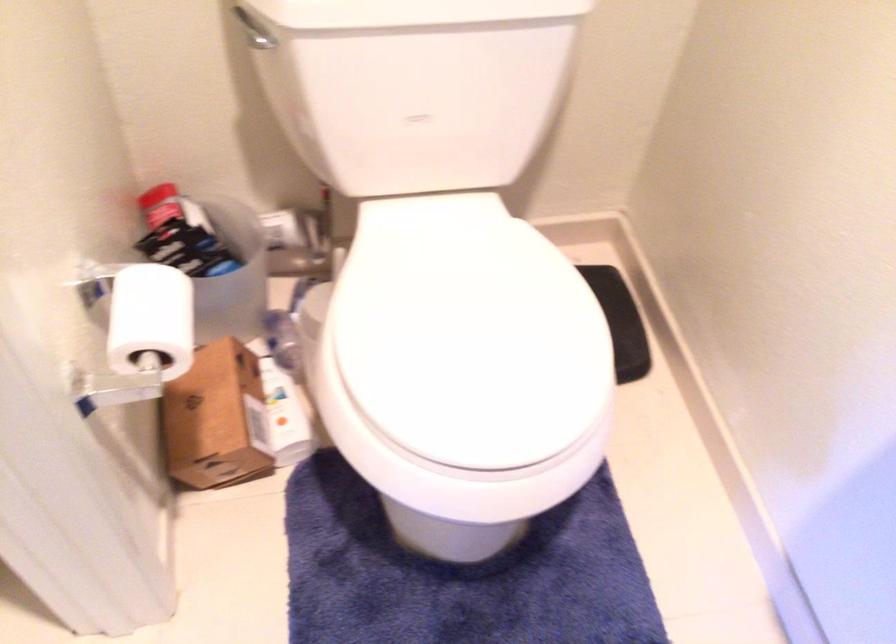
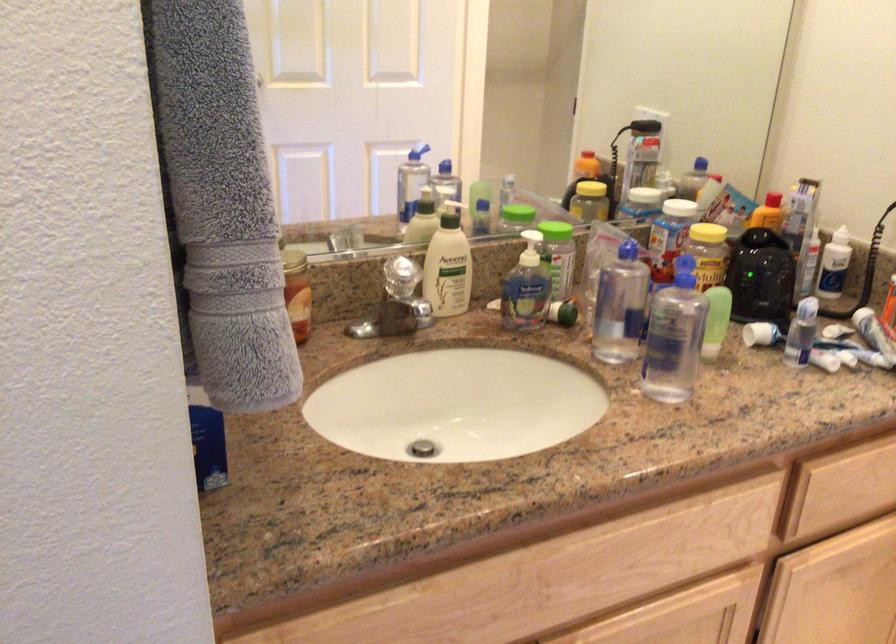
Question: I am providing you with two images of the same scene from different viewpoints. Which of the following objects are not visible in image2?

Choices:
 (A) can with red cap
 (B) white lotion pump
 (C) green soap pump
 (D) red apple pushpin

Answer: (A)